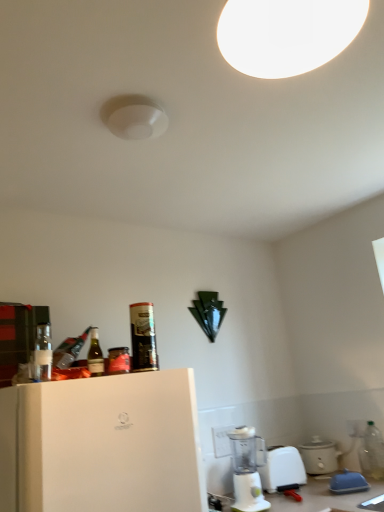
Question: From a real-world perspective, is metallic can at upper left, marked as the 4th bottle in a bottom-to-top arrangement, over clear plastic bottle at lower right, placed as the first bottle when sorted from bottom to top?

Choices:
 (A) no
 (B) yes

Answer: (B)

Question: Is metallic can at upper left, marked as the 2th bottle in a back-to-front arrangement, positioned in front of clear plastic bottle at lower right, the 4th bottle positioned from the front?

Choices:
 (A) yes
 (B) no

Answer: (A)

Question: From the image's perspective, is metallic can at upper left, marked as the 2th bottle in a back-to-front arrangement, below clear plastic bottle at lower right, which is the first bottle in right-to-left order?

Choices:
 (A) no
 (B) yes

Answer: (A)

Question: Can you confirm if metallic can at upper left, the 2th bottle in the right-to-left sequence, is taller than clear plastic bottle at lower right, the 4th bottle positioned from the front?

Choices:
 (A) no
 (B) yes

Answer: (A)

Question: Considering the relative sizes of metallic can at upper left, positioned as the 1th bottle in top-to-bottom order, and clear plastic bottle at lower right, the 4th bottle positioned from the front, in the image provided, is metallic can at upper left, positioned as the 1th bottle in top-to-bottom order, bigger than clear plastic bottle at lower right, the 4th bottle positioned from the front,?

Choices:
 (A) yes
 (B) no

Answer: (B)

Question: From a real-world perspective, is clear plastic bottle at lower right, which appears as the 1th bottle when viewed from the back, positioned above or below white matte light fixture at upper center?

Choices:
 (A) below
 (B) above

Answer: (A)

Question: In terms of size, does clear plastic bottle at lower right, placed as the fourth bottle when sorted from top to bottom, appear bigger or smaller than white matte light fixture at upper center?

Choices:
 (A) big
 (B) small

Answer: (B)

Question: In the image, is clear plastic bottle at lower right, placed as the fourth bottle when sorted from top to bottom, on the left side or the right side of white matte light fixture at upper center?

Choices:
 (A) right
 (B) left

Answer: (A)

Question: In terms of height, does clear plastic bottle at lower right, which appears as the 1th bottle when viewed from the back, look taller or shorter compared to white matte light fixture at upper center?

Choices:
 (A) tall
 (B) short

Answer: (A)

Question: Is white plastic blender at lower center taller or shorter than blue plastic butter dish at lower right, which is the first appliance in front-to-back order?

Choices:
 (A) short
 (B) tall

Answer: (B)

Question: Considering the positions of white plastic blender at lower center and blue plastic butter dish at lower right, which is the first appliance in front-to-back order, in the image, is white plastic blender at lower center wider or thinner than blue plastic butter dish at lower right, which is the first appliance in front-to-back order,?

Choices:
 (A) thin
 (B) wide

Answer: (B)

Question: Is white plastic blender at lower center situated inside blue plastic butter dish at lower right, which is the second appliance from back to front, or outside?

Choices:
 (A) outside
 (B) inside

Answer: (A)

Question: From a real-world perspective, is white plastic blender at lower center physically located above or below blue plastic butter dish at lower right, which is the first appliance in front-to-back order?

Choices:
 (A) above
 (B) below

Answer: (A)

Question: Based on their sizes in the image, would you say matte white slow cooker at lower right, the 1th appliance in the back-to-front sequence, is bigger or smaller than white plastic blender at lower center?

Choices:
 (A) small
 (B) big

Answer: (B)

Question: Considering the positions of matte white slow cooker at lower right, which appears as the 2th appliance when viewed from the front, and white plastic blender at lower center in the image, is matte white slow cooker at lower right, which appears as the 2th appliance when viewed from the front, wider or thinner than white plastic blender at lower center?

Choices:
 (A) thin
 (B) wide

Answer: (B)